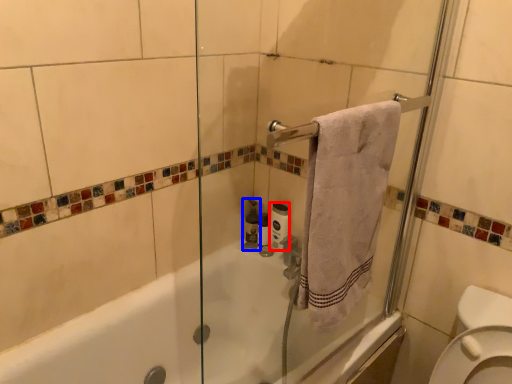
Question: Which object appears closest to the camera in this image, toilet paper (highlighted by a red box) or toiletry (highlighted by a blue box)?

Choices:
 (A) toilet paper
 (B) toiletry

Answer: (A)